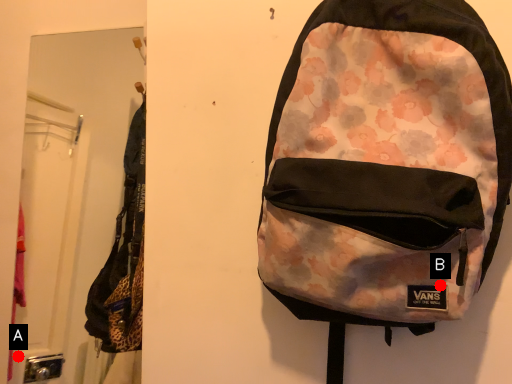
Question: Two points are circled on the image, labeled by A and B beside each circle. Among these points, which one is nearest to the camera?

Choices:
 (A) A is closer
 (B) B is closer

Answer: (B)